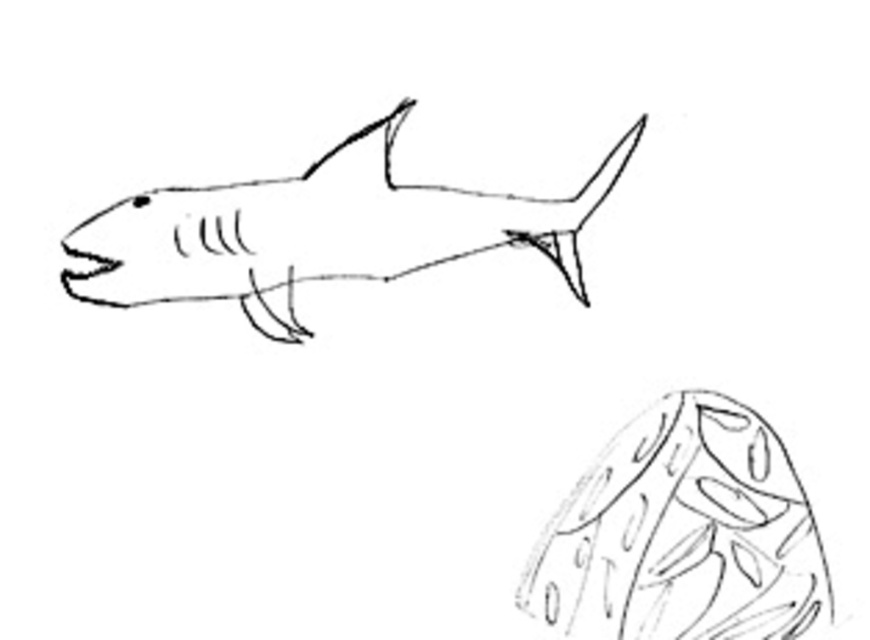
Is black line shark at upper center taller than smooth gray fish at upper center?

Incorrect, black line shark at upper center's height is not larger of smooth gray fish at upper center's.

Is black line shark at upper center above smooth gray fish at upper center?

Indeed, black line shark at upper center is positioned over smooth gray fish at upper center.

Who is more forward, (202,212) or (781,614)?

Point (781,614)

Find the location of a particular element. black line shark at upper center is located at coordinates (319, 230).